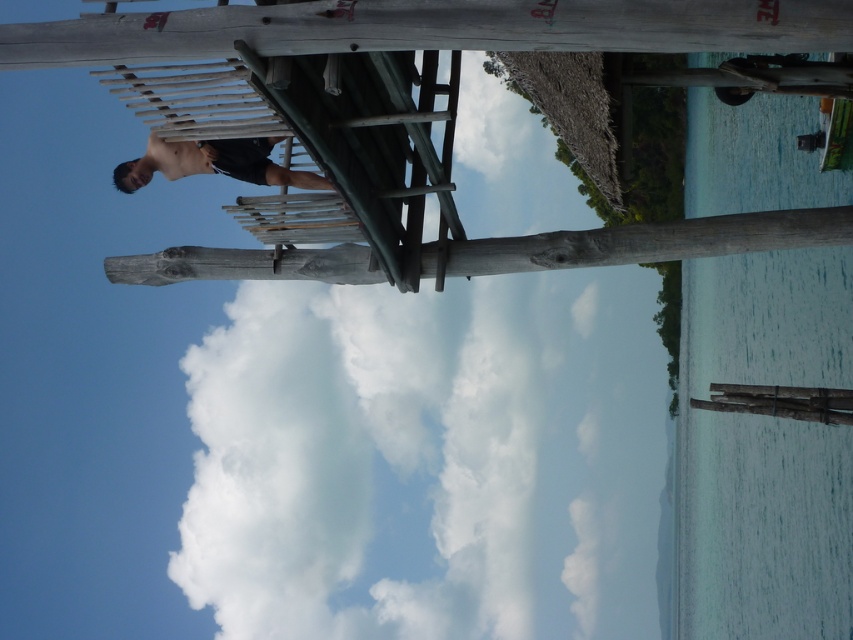
Does white fluffy cloud at upper center appear on the right side of natural wood beam at center?

Yes, white fluffy cloud at upper center is to the right of natural wood beam at center.

Is white fluffy cloud at upper center shorter than natural wood beam at center?

No.

This screenshot has width=853, height=640. In order to click on white fluffy cloud at upper center in this screenshot , I will do `click(431, 461)`.

This screenshot has width=853, height=640. I want to click on white fluffy cloud at upper center, so click(431, 461).

Who is lower down, natural wood beam at center or dark brown wood person at center?

natural wood beam at center

Is natural wood beam at center positioned before dark brown wood person at center?

No, it is not.

The width and height of the screenshot is (853, 640). I want to click on natural wood beam at center, so click(653, 241).

Between point (566, 484) and point (151, 134), which one is positioned in front?

Point (151, 134) is more forward.

Does point (561, 461) lie behind point (198, 144)?

Yes, it is behind point (198, 144).

Find the location of `white fluffy cloud at upper center`. white fluffy cloud at upper center is located at coordinates (431, 461).